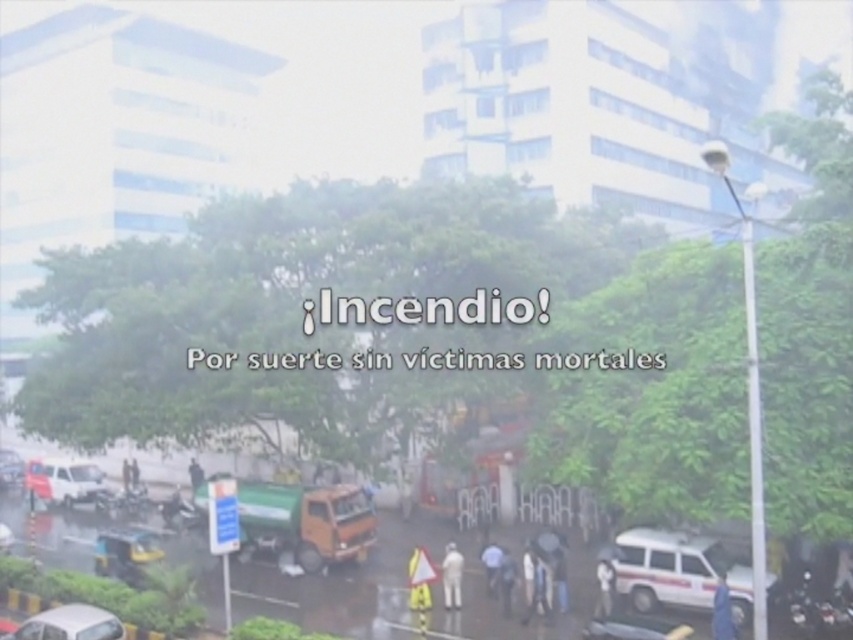
Question: Based on their relative distances, which object is nearer to the dark gray fabric at center?

Choices:
 (A) blue fabric person at lower right
 (B) white matte ambulance at lower right

Answer: (B)

Question: Considering the real-world distances, which object is farthest from the metallic silver car at lower left?

Choices:
 (A) white matte person at lower right
 (B) white matte car at lower left

Answer: (A)

Question: Which point is closer to the camera?

Choices:
 (A) white matte ambulance at lower right
 (B) metallic silver car at lower left
 (C) metallic silver car at center

Answer: (C)

Question: Is white matte ambulance at lower right positioned behind dark gray fabric at center?

Choices:
 (A) yes
 (B) no

Answer: (B)

Question: Is white matte ambulance at lower right to the left of white matte person at center from the viewer's perspective?

Choices:
 (A) yes
 (B) no

Answer: (B)

Question: Can you confirm if white matte van at lower left is smaller than dark blue shirt at center?

Choices:
 (A) yes
 (B) no

Answer: (B)